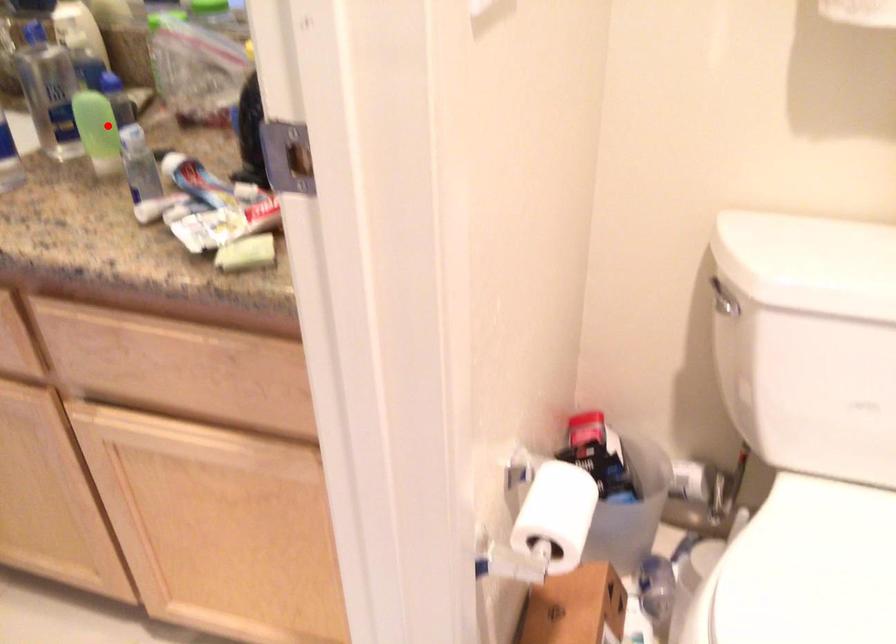
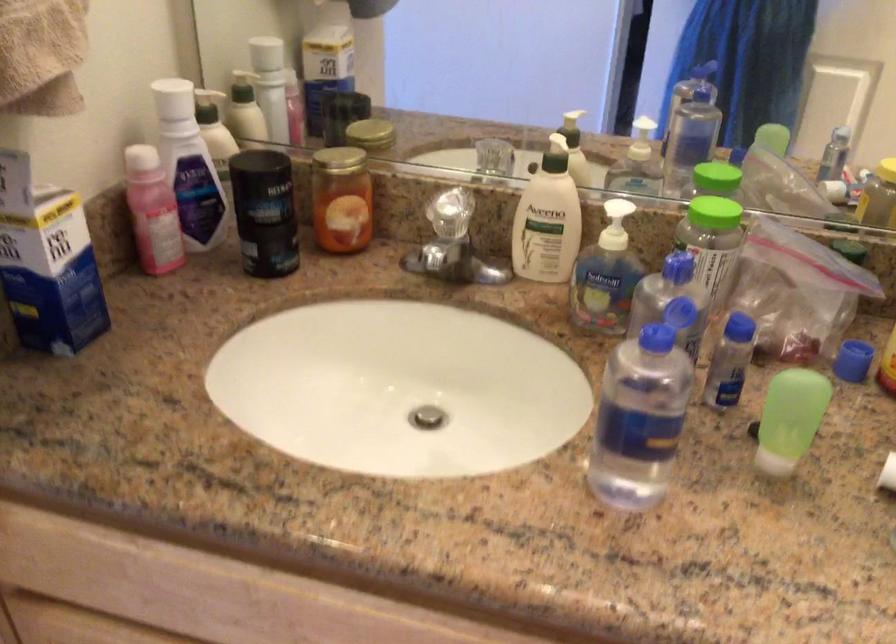
Locate, in the second image, the point that corresponds to the highlighted location in the first image.

(789, 419)